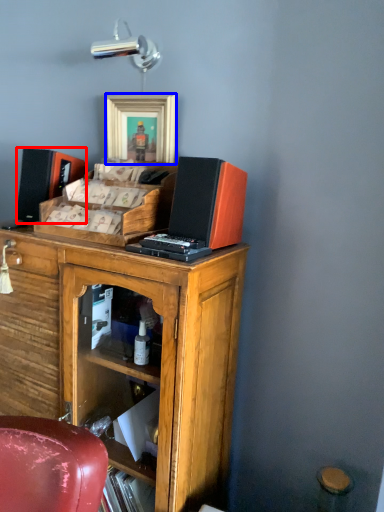
Question: Which point is further to the camera, speaker (highlighted by a red box) or picture frame (highlighted by a blue box)?

Choices:
 (A) speaker
 (B) picture frame

Answer: (A)